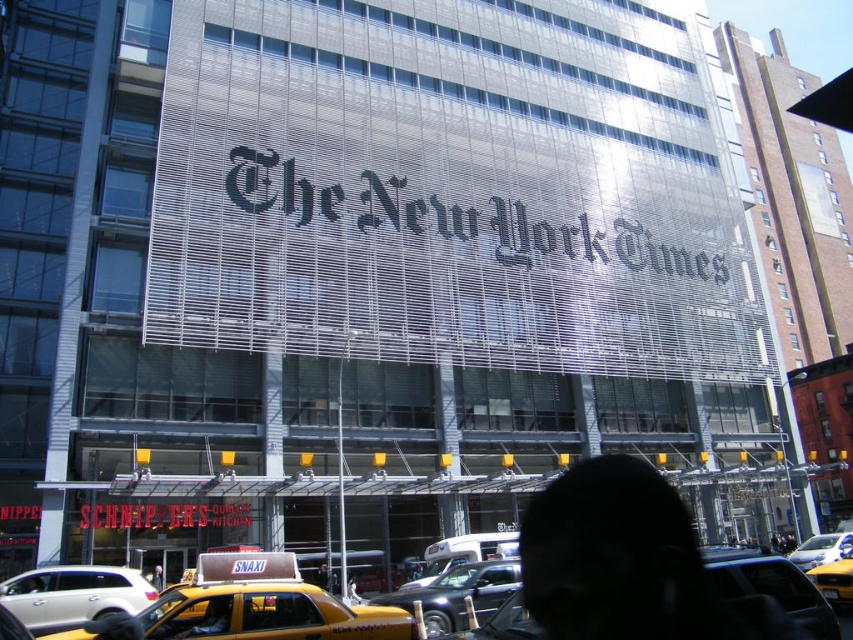
Is yellow matte taxi at lower center to the right of metallic silver car at center from the viewer's perspective?

No, yellow matte taxi at lower center is not to the right of metallic silver car at center.

Describe the element at coordinates (264, 605) in the screenshot. The height and width of the screenshot is (640, 853). I see `yellow matte taxi at lower center` at that location.

At what (x,y) coordinates should I click in order to perform the action: click on yellow matte taxi at lower center. Please return your answer as a coordinate pair (x, y). The image size is (853, 640). Looking at the image, I should click on (264, 605).

How distant is yellow matte taxi at lower center from yellow rubber taxi at center?

They are 19.77 meters apart.

Is yellow matte taxi at lower center taller than yellow rubber taxi at center?

Indeed, yellow matte taxi at lower center has a greater height compared to yellow rubber taxi at center.

Which is behind, point (160, 611) or point (817, 582)?

The point (817, 582) is more distant.

This screenshot has width=853, height=640. Find the location of `yellow matte taxi at lower center`. yellow matte taxi at lower center is located at coordinates (264, 605).

Can you confirm if black hair at center is positioned above yellow matte taxi at lower center?

Yes, black hair at center is above yellow matte taxi at lower center.

Which is in front, point (694, 545) or point (257, 580)?

Positioned in front is point (694, 545).

Between point (747, 600) and point (167, 605), which one is positioned behind?

Positioned behind is point (167, 605).

Identify the location of black hair at center. The image size is (853, 640). (627, 563).